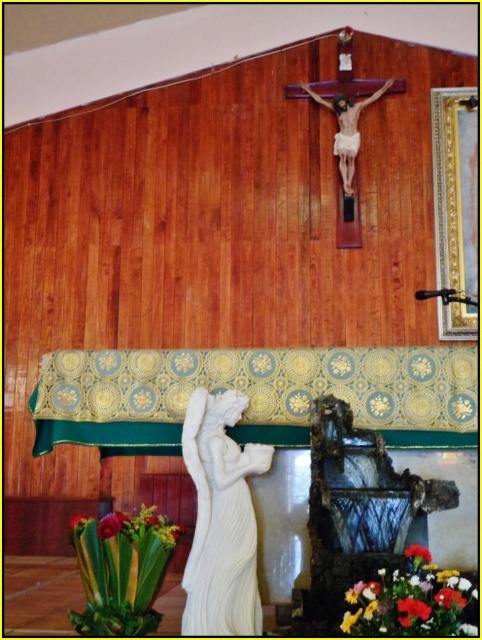
Question: Among these objects, which one is nearest to the camera?

Choices:
 (A) vibrant floral bouquet at lower right
 (B) green leafy plant at lower left
 (C) red matte flower at lower right
 (D) white marble statue at center

Answer: (A)

Question: Observing the image, what is the correct spatial positioning of white marble statue at center in reference to vivid red petals at lower right?

Choices:
 (A) right
 (B) left

Answer: (B)

Question: Does wooden crucifix at upper center have a lesser width compared to red matte flower at lower right?

Choices:
 (A) no
 (B) yes

Answer: (A)

Question: Based on their relative distances, which object is farther from the wooden crucifix at upper center?

Choices:
 (A) white marble statue at center
 (B) vivid red petals at lower right
 (C) green leafy plant at lower left
 (D) red matte flower at lower right

Answer: (B)

Question: Which of these objects is positioned closest to the wooden crucifix at upper center?

Choices:
 (A) vivid red petals at lower right
 (B) red matte flower at lower right
 (C) green leafy plant at lower left

Answer: (C)

Question: Does vibrant floral bouquet at lower right come behind red matte flower at lower right?

Choices:
 (A) yes
 (B) no

Answer: (B)